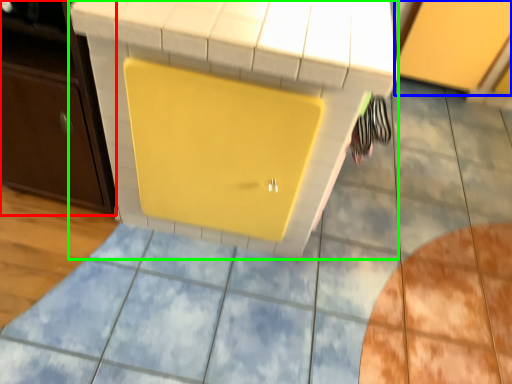
Question: Considering the real-world distances, which object is farthest from cabinetry (highlighted by a red box)? cabinetry (highlighted by a blue box) or vanity (highlighted by a green box)?

Choices:
 (A) cabinetry
 (B) vanity

Answer: (A)